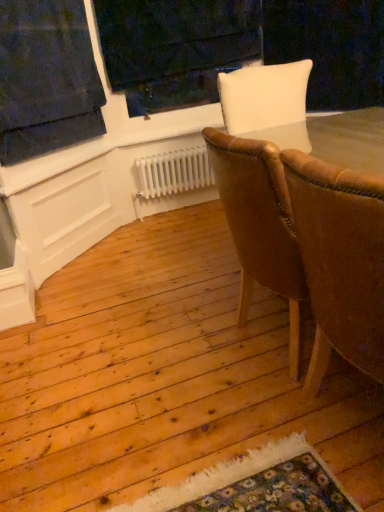
Question: From a real-world perspective, relative to dark blue fabric at upper left, is white painted wood at upper center vertically above or below?

Choices:
 (A) below
 (B) above

Answer: (A)

Question: From the image's perspective, relative to dark blue fabric at upper left, is white painted wood at upper center above or below?

Choices:
 (A) above
 (B) below

Answer: (A)

Question: Based on their relative distances, which object is farther from the white painted wood at upper center?

Choices:
 (A) dark blue fabric at upper left
 (B) brown leather chair at right, acting as the 2th chair starting from the back
 (C) brown leather chair at center, which is the first chair in back-to-front order
 (D) white metallic radiator at center

Answer: (B)

Question: Which is nearer to the white painted wood at upper center?

Choices:
 (A) dark blue fabric at upper left
 (B) white metallic radiator at center
 (C) brown leather chair at center, placed as the 2th chair when sorted from front to back
 (D) brown leather chair at right, which ranks as the 1th chair in front-to-back order

Answer: (A)